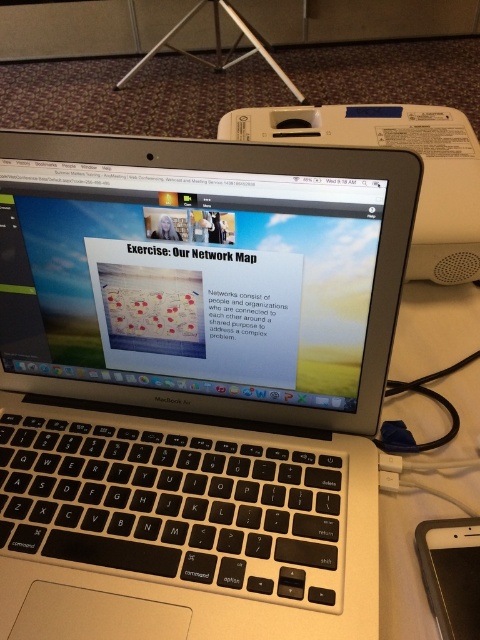
Can you confirm if silver metallic laptop at center is shorter than white plastic speaker at upper right?

Incorrect, silver metallic laptop at center's height does not fall short of white plastic speaker at upper right's.

Does silver metallic laptop at center appear over white plastic speaker at upper right?

Incorrect, silver metallic laptop at center is not positioned above white plastic speaker at upper right.

Find the location of a particular element. The height and width of the screenshot is (640, 480). silver metallic laptop at center is located at coordinates (193, 385).

Where is `silver metallic laptop at center`? Image resolution: width=480 pixels, height=640 pixels. silver metallic laptop at center is located at coordinates 193,385.

Is point (343, 125) positioned in front of point (472, 518)?

No, (343, 125) is behind (472, 518).

Which is more to the left, white plastic speaker at upper right or black plastic ipad at lower right?

white plastic speaker at upper right

Is point (423, 276) closer to viewer compared to point (465, 522)?

No, it is behind (465, 522).

The height and width of the screenshot is (640, 480). In order to click on white plastic speaker at upper right in this screenshot , I will do `click(396, 147)`.

Does silver metallic laptop at center have a lesser width compared to black plastic ipad at lower right?

No, silver metallic laptop at center is not thinner than black plastic ipad at lower right.

Which is below, silver metallic laptop at center or black plastic ipad at lower right?

Positioned lower is black plastic ipad at lower right.

The height and width of the screenshot is (640, 480). What do you see at coordinates (193, 385) in the screenshot? I see `silver metallic laptop at center` at bounding box center [193, 385].

I want to click on silver metallic laptop at center, so coord(193,385).